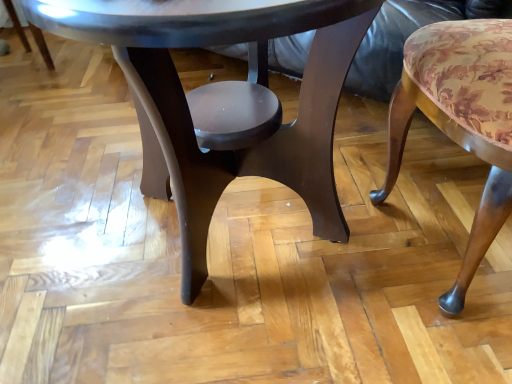
Question: Looking at their shapes, would you say floral fabric cushion at right is wider or thinner than glossy dark wood coffee table at center?

Choices:
 (A) thin
 (B) wide

Answer: (A)

Question: Visually, is floral fabric cushion at right positioned to the left or to the right of glossy dark wood coffee table at center?

Choices:
 (A) right
 (B) left

Answer: (A)

Question: Which is correct: floral fabric cushion at right is inside glossy dark wood coffee table at center, or outside of it?

Choices:
 (A) outside
 (B) inside

Answer: (A)

Question: Would you say glossy dark wood coffee table at center is to the left or to the right of floral fabric cushion at right in the picture?

Choices:
 (A) left
 (B) right

Answer: (A)

Question: Considering the positions of point (329, 147) and point (403, 72), is point (329, 147) closer or farther from the camera than point (403, 72)?

Choices:
 (A) farther
 (B) closer

Answer: (A)

Question: From the image's perspective, is glossy dark wood coffee table at center located above or below floral fabric cushion at right?

Choices:
 (A) below
 (B) above

Answer: (B)

Question: From a real-world perspective, is glossy dark wood coffee table at center above or below floral fabric cushion at right?

Choices:
 (A) below
 (B) above

Answer: (B)